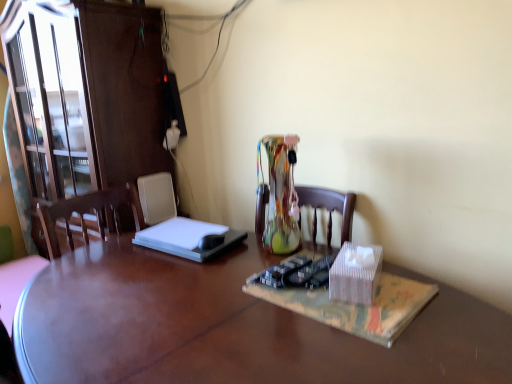
Where is `free space in front of white cardboard box at center`? This screenshot has height=384, width=512. free space in front of white cardboard box at center is located at coordinates (393, 328).